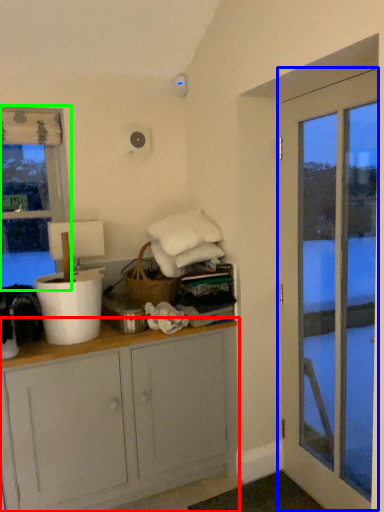
Question: Estimate the real-world distances between objects in this image. Which object is closer to cabinetry (highlighted by a red box), door (highlighted by a blue box) or window (highlighted by a green box)?

Choices:
 (A) door
 (B) window

Answer: (A)